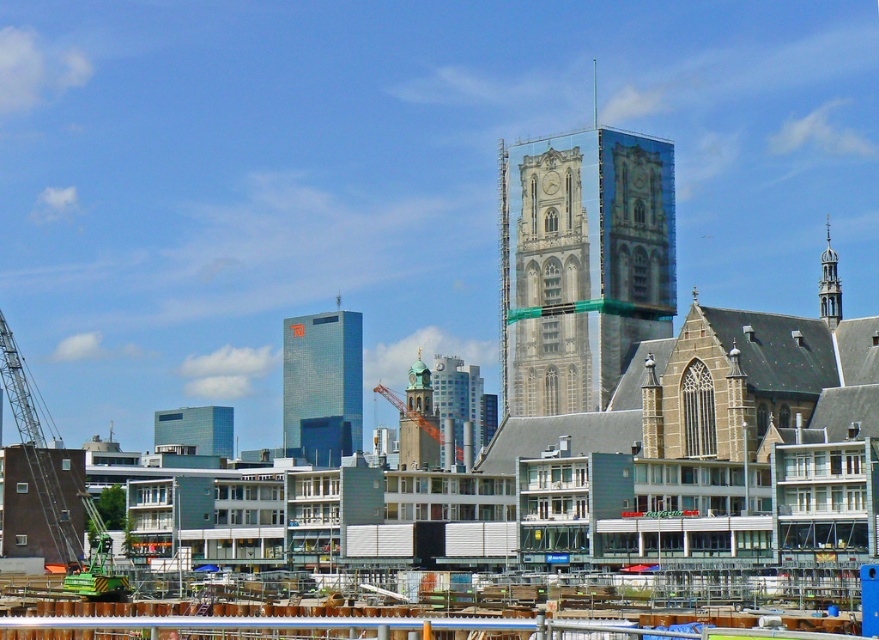
You are a construction worker who needs to move a heavy beam from the construction site to the modern buildings on the left. Given the green metallic crane at left is positioned at coordinates 0.700, 0.041, can you determine if the crane is close enough to safely lift the beam and place it near the modern buildings?

The green metallic crane at left is located at point [35,448], which is already positioned near the modern buildings on the left. Therefore, it can safely lift and place the beam there.